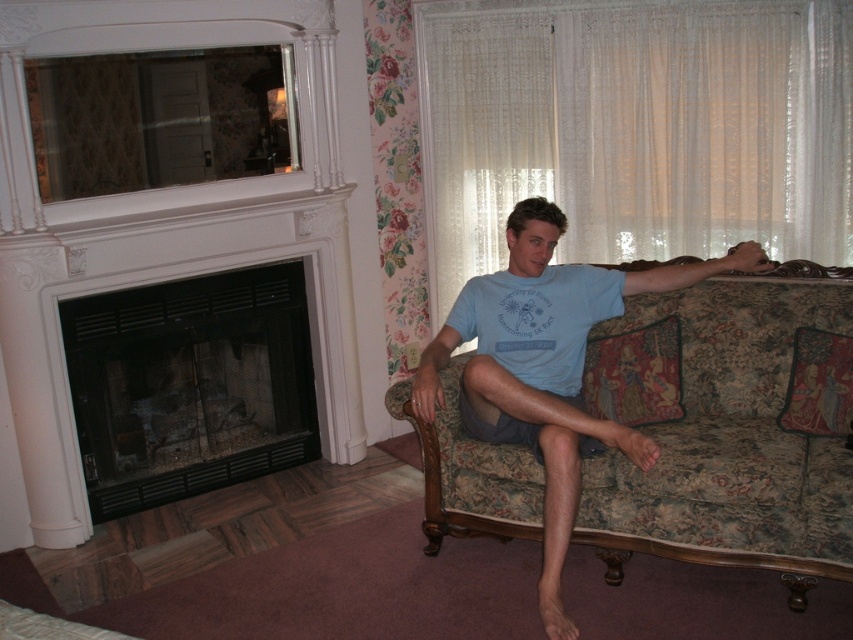
You are a delivery person trying to place a large package that is 5 feet long between the floral fabric couch at right and the black glass fireplace at left. Can you fit the package between them without moving either object?

The distance between the floral fabric couch at right and the black glass fireplace at left is 4.74 feet, which is shorter than the package length of 5 feet. Therefore, the package cannot be placed between them without moving either object.

You are arranging a small table between the floral fabric couch at right and the black glass fireplace at left. If the table is 1.2 meters wide, can it fit between them considering their widths?

The floral fabric couch at right is wider than the black glass fireplace at left. Since the table is 1.2 meters wide, it depends on the actual widths of the couch and fireplace. However, the description only states the couch is wider, not the exact dimensions, so we cannot confirm if the table will fit without more information.

From the picture: You are sitting on the floral fabric couch at right and want to reach the black glass fireplace at left to add more logs. Is the fireplace directly in front of you or to your left?

The floral fabric couch at right is to the right of black glass fireplace at left, so the fireplace is to your left when sitting on the couch.